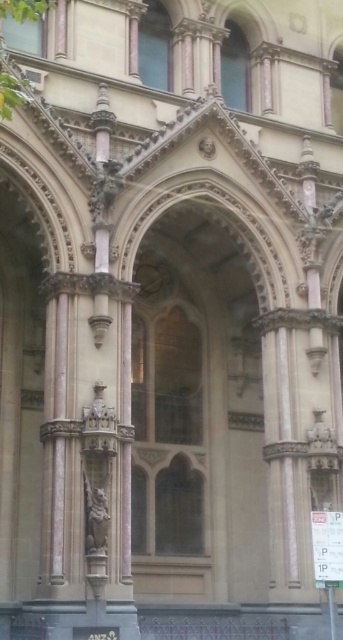
You are an architect examining the Gothic building facade. You notice the beige stone archway at center and the carved stone statue at center. Which of these two elements is larger in size?

The beige stone archway at center is bigger than the carved stone statue at center.